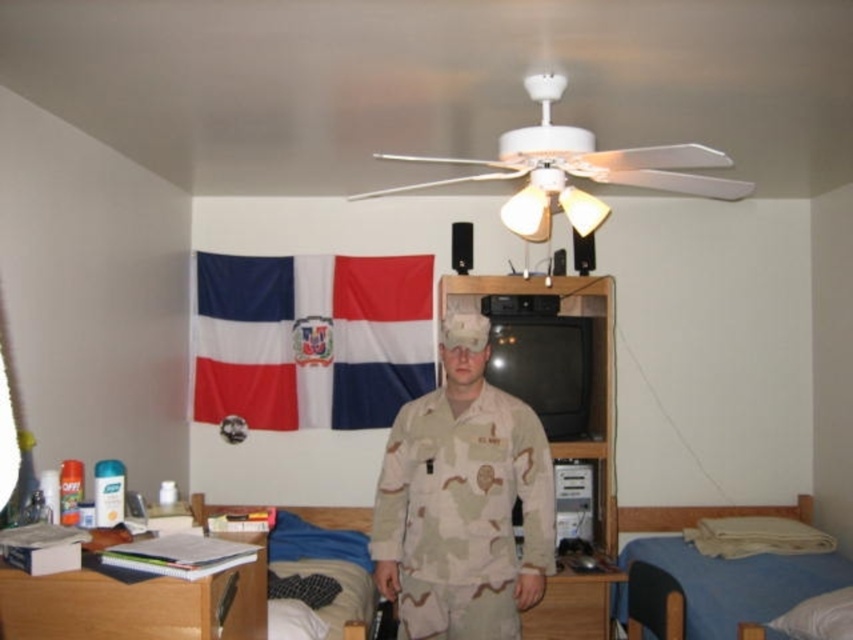
Which is in front, point (3, 628) or point (550, 625)?

Point (3, 628)

Is wooden at left wider than wooden drawer at lower center?

Indeed, wooden at left has a greater width compared to wooden drawer at lower center.

Identify the location of wooden at left. (136, 604).

Is camouflage fabric uniform at center shorter than blue fabric bed at lower left?

Incorrect, camouflage fabric uniform at center's height does not fall short of blue fabric bed at lower left's.

Does camouflage fabric uniform at center appear on the left side of blue fabric bed at lower left?

No, camouflage fabric uniform at center is not to the left of blue fabric bed at lower left.

Find the location of a particular element. camouflage fabric uniform at center is located at coordinates (462, 513).

Which is more to the left, camouflage fabric uniform at center or blue fabric bed at lower right?

camouflage fabric uniform at center is more to the left.

Who is higher up, camouflage fabric uniform at center or blue fabric bed at lower right?

camouflage fabric uniform at center

This screenshot has width=853, height=640. What are the coordinates of `camouflage fabric uniform at center` in the screenshot? It's located at (462, 513).

Locate an element on the screen. camouflage fabric uniform at center is located at coordinates (462, 513).